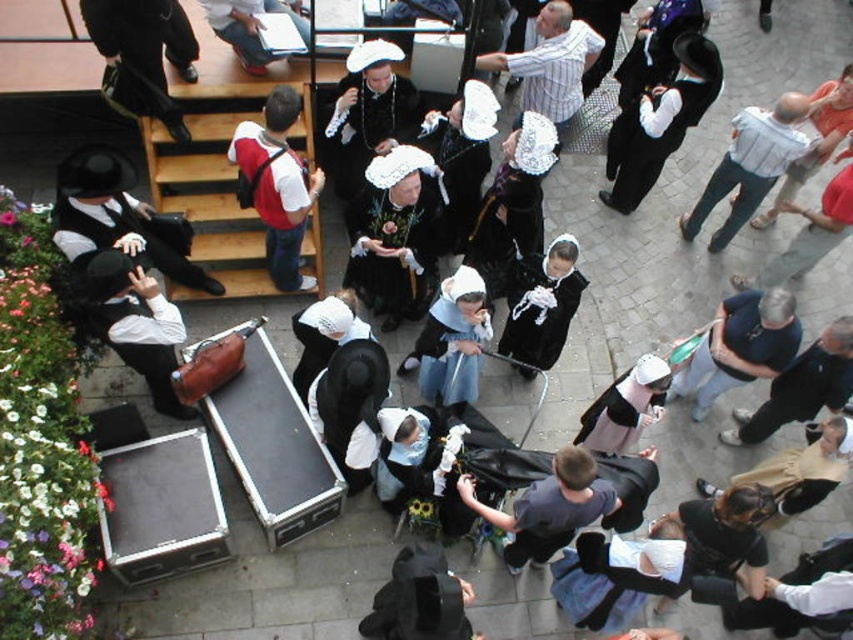
From the picture: Which is more to the right, matte black hat at left or striped cotton shirt at center?

striped cotton shirt at center is more to the right.

Between matte black hat at left and striped cotton shirt at center, which one appears on the left side from the viewer's perspective?

matte black hat at left is more to the left.

Who is more distant from viewer, (61, 237) or (532, 99)?

The point (532, 99) is more distant.

Identify the location of matte black hat at left. The image size is (853, 640). (119, 218).

Does point (741, 163) come behind point (511, 54)?

No, it is in front of (511, 54).

You are a GUI agent. You are given a task and a screenshot of the screen. Output one action in this format:
    pyautogui.click(x=<x>, y=<y>)
    Task: Click on the white cotton shirt at upper right
    The image size is (853, 640).
    Given the screenshot: What is the action you would take?
    pyautogui.click(x=750, y=164)

Which is in front, point (187, 237) or point (776, 164)?

Point (187, 237) is more forward.

Based on the photo, is matte black hat at left below white cotton shirt at upper right?

Indeed, matte black hat at left is positioned under white cotton shirt at upper right.

Find the location of a particular element. The image size is (853, 640). matte black hat at left is located at coordinates (119, 218).